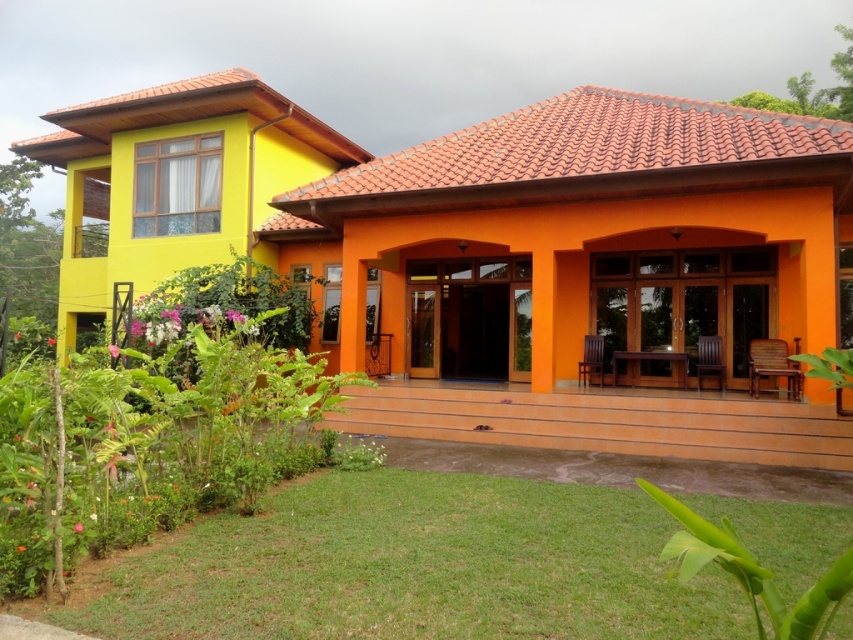
Question: Can you confirm if green grass at lower left is wider than green leafy plants at lower left?

Choices:
 (A) yes
 (B) no

Answer: (A)

Question: Which point is closer to the camera taking this photo?

Choices:
 (A) (511, 602)
 (B) (83, 456)

Answer: (A)

Question: In this image, where is green grass at lower left located relative to green leafy plants at lower left?

Choices:
 (A) below
 (B) above

Answer: (A)

Question: Does green grass at lower left appear on the left side of green leafy plants at lower left?

Choices:
 (A) yes
 (B) no

Answer: (B)

Question: Which of the following is the closest to the observer?

Choices:
 (A) green grass at lower left
 (B) green leafy plants at lower left

Answer: (A)

Question: Among these objects, which one is farthest from the camera?

Choices:
 (A) green grass at lower left
 (B) green leafy plants at lower left

Answer: (B)